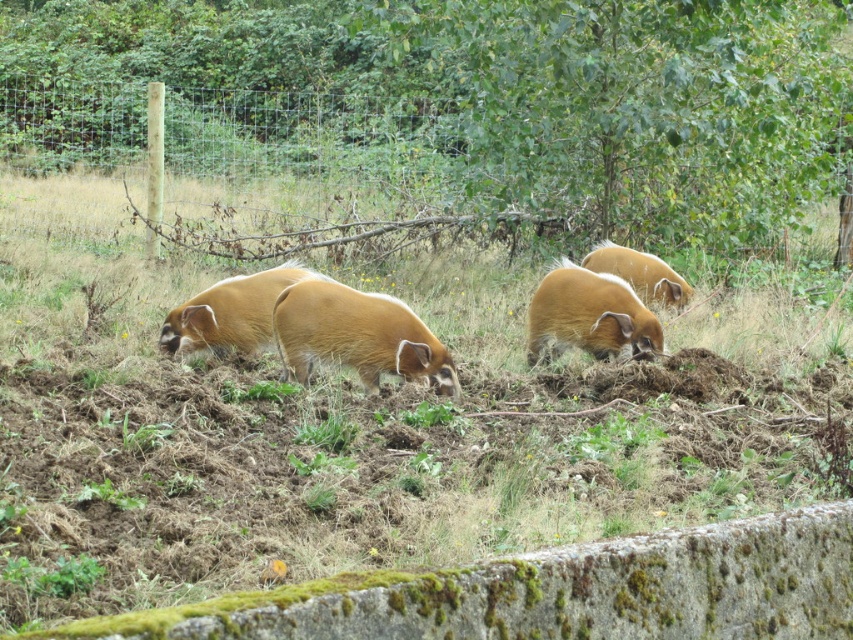
Question: Considering the real-world distances, which object is farthest from the golden fur boar at center?

Choices:
 (A) wooden post at upper left
 (B) brown grass at center
 (C) golden fur boar at left
 (D) golden-brown fur pig at center

Answer: (A)

Question: Can you confirm if brown grass at center is positioned above golden fur boar at center?

Choices:
 (A) yes
 (B) no

Answer: (B)

Question: Does brown grass at center appear on the left side of brown furry pig at center?

Choices:
 (A) yes
 (B) no

Answer: (B)

Question: Which point is farther to the camera?

Choices:
 (A) (598, 412)
 (B) (236, 316)
 (C) (555, 269)
 (D) (589, 259)

Answer: (D)

Question: Which object is the closest to the golden fur boar at center?

Choices:
 (A) wooden post at upper left
 (B) golden fur boar at left
 (C) brown grass at center

Answer: (C)

Question: Observing the image, what is the correct spatial positioning of wooden post at upper left in reference to brown furry pig at center?

Choices:
 (A) below
 (B) above

Answer: (B)